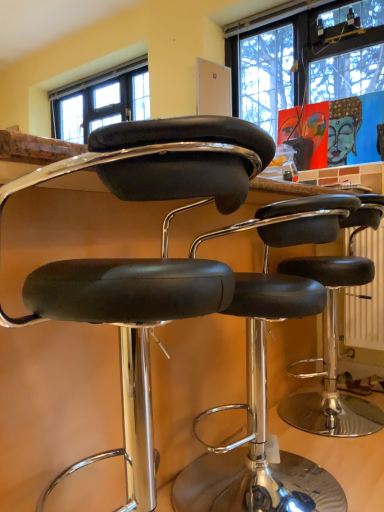
Question: Visually, is black leather stool at center, which is the second chair in front-to-back order, positioned to the left or to the right of black leather stool at center, which is counted as the second chair, starting from the back?

Choices:
 (A) left
 (B) right

Answer: (B)

Question: In terms of height, does black leather stool at center, the 1th chair viewed from the back, look taller or shorter compared to black leather stool at center, which is the 1th chair from front to back?

Choices:
 (A) tall
 (B) short

Answer: (B)

Question: Considering the positions of black leather stool at center, which is the second chair in front-to-back order, and black leather stool at center, which is the 1th chair from front to back, in the image, is black leather stool at center, which is the second chair in front-to-back order, bigger or smaller than black leather stool at center, which is the 1th chair from front to back,?

Choices:
 (A) big
 (B) small

Answer: (B)

Question: Considering the positions of point (69, 308) and point (246, 410), is point (69, 308) closer or farther from the camera than point (246, 410)?

Choices:
 (A) farther
 (B) closer

Answer: (B)

Question: Considering their positions, is black leather stool at center, which is counted as the second chair, starting from the back, located in front of or behind black leather stool at center, which is the second chair in front-to-back order?

Choices:
 (A) front
 (B) behind

Answer: (A)

Question: From their relative heights in the image, would you say black leather stool at center, which is the 1th chair from front to back, is taller or shorter than black leather stool at center, which is the second chair in front-to-back order?

Choices:
 (A) tall
 (B) short

Answer: (A)

Question: Would you say black leather stool at center, which is counted as the second chair, starting from the back, is to the left or to the right of black leather stool at center, the 1th chair viewed from the back, in the picture?

Choices:
 (A) right
 (B) left

Answer: (B)